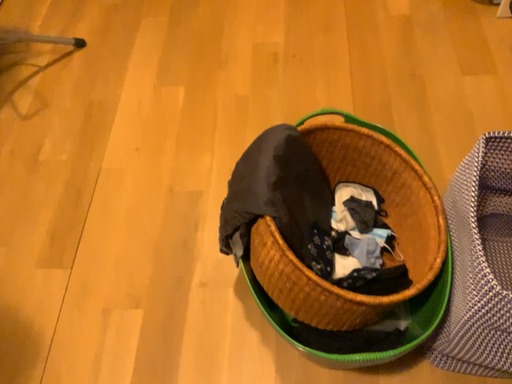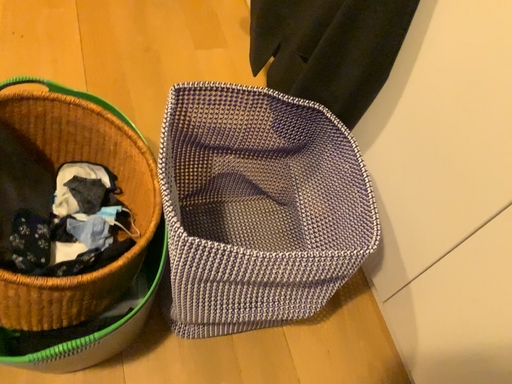
Question: Which way did the camera rotate in the video?

Choices:
 (A) rotated right
 (B) rotated left

Answer: (A)